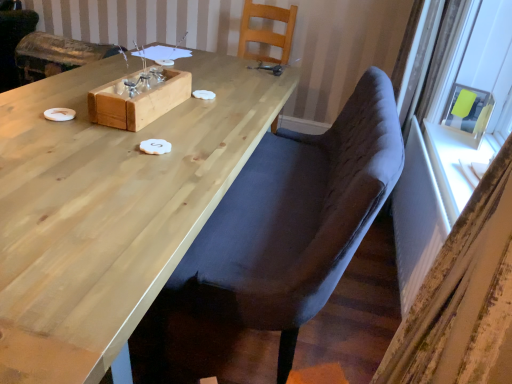
This screenshot has width=512, height=384. What do you see at coordinates (289, 226) in the screenshot?
I see `velvet grey chair at center, the 2th chair from the back` at bounding box center [289, 226].

What do you see at coordinates (110, 208) in the screenshot? This screenshot has height=384, width=512. I see `natural wood table at center` at bounding box center [110, 208].

Identify the location of wooden box at center. (138, 102).

What do you see at coordinates (138, 102) in the screenshot? I see `wooden box at center` at bounding box center [138, 102].

How much space does wooden chair at upper center, arranged as the 1th chair when viewed from the back, occupy vertically?

The height of wooden chair at upper center, arranged as the 1th chair when viewed from the back, is 36.53 inches.

You are a GUI agent. You are given a task and a screenshot of the screen. Output one action in this format:
    pyautogui.click(x=<x>, y=<y>)
    Task: Click on the wooden chair at upper center, placed as the 2th chair when sorted from front to back
    
    Given the screenshot: What is the action you would take?
    pyautogui.click(x=267, y=30)

You are a GUI agent. You are given a task and a screenshot of the screen. Output one action in this format:
    pyautogui.click(x=<x>, y=<y>)
    Task: Click on the yellow paper at upper right
    
    Given the screenshot: What is the action you would take?
    pyautogui.click(x=468, y=109)

Measure the distance between point (x=504, y=253) and camera.

Point (x=504, y=253) and camera are 28.98 inches apart.

Find the location of a particular element. velvet grey chair at center, the 2th chair from the back is located at coordinates (289, 226).

Between point (268, 8) and point (55, 52), which one is positioned behind?

Point (55, 52)

How different are the orientations of wooden chair at upper center, placed as the 2th chair when sorted from front to back, and wooden armchair at upper left in degrees?

4.15 degrees.

Considering the relative sizes of wooden chair at upper center, placed as the 2th chair when sorted from front to back, and wooden armchair at upper left in the image provided, is wooden chair at upper center, placed as the 2th chair when sorted from front to back, thinner than wooden armchair at upper left?

No.

Which object is thinner, velvet grey chair at center, arranged as the first chair when viewed from the front, or yellow paper at upper right?

With smaller width is yellow paper at upper right.

From the image's perspective, which is above, velvet grey chair at center, the 2th chair from the back, or yellow paper at upper right?

yellow paper at upper right appears higher in the image.

Considering the relative sizes of velvet grey chair at center, arranged as the first chair when viewed from the front, and yellow paper at upper right in the image provided, is velvet grey chair at center, arranged as the first chair when viewed from the front, taller than yellow paper at upper right?

Indeed, velvet grey chair at center, arranged as the first chair when viewed from the front, has a greater height compared to yellow paper at upper right.

Is wooden chair at upper center, placed as the 2th chair when sorted from front to back, further to the viewer compared to natural wood table at center?

Yes, it is.

From a real-world perspective, is wooden chair at upper center, arranged as the 1th chair when viewed from the back, beneath natural wood table at center?

Incorrect, from a real-world perspective, wooden chair at upper center, arranged as the 1th chair when viewed from the back, is higher than natural wood table at center.

Does wooden chair at upper center, placed as the 2th chair when sorted from front to back, appear on the left side of natural wood table at center?

No.

Which object is wider, wooden chair at upper center, arranged as the 1th chair when viewed from the back, or natural wood table at center?

natural wood table at center.

Does natural wood table at center contain wooden chair at upper center, arranged as the 1th chair when viewed from the back?

No, wooden chair at upper center, arranged as the 1th chair when viewed from the back, is not a part of natural wood table at center.

Does natural wood table at center lie in front of wooden chair at upper center, arranged as the 1th chair when viewed from the back?

Yes, natural wood table at center is closer to the viewer.

Based on the photo, from a real-world perspective, is natural wood table at center below wooden chair at upper center, arranged as the 1th chair when viewed from the back?

Yes, from a real-world perspective, natural wood table at center is beneath wooden chair at upper center, arranged as the 1th chair when viewed from the back.

The image size is (512, 384). In order to click on chair lying above the natural wood table at center (from the image's perspective) in this screenshot , I will do `click(267, 30)`.

Which is more to the left, wooden armchair at upper left or wooden box at center?

From the viewer's perspective, wooden armchair at upper left appears more on the left side.

Between wooden armchair at upper left and wooden box at center, which one is positioned in front?

wooden box at center is more forward.

Is wooden armchair at upper left positioned beyond the bounds of wooden box at center?

Yes, wooden armchair at upper left is not within wooden box at center.

Does wooden armchair at upper left have a lesser height compared to wooden box at center?

No.

Between natural wood table at center and yellow paper at upper right, which one has smaller width?

yellow paper at upper right.

Considering the sizes of objects natural wood table at center and yellow paper at upper right in the image provided, who is bigger, natural wood table at center or yellow paper at upper right?

natural wood table at center is bigger.

Is natural wood table at center taller than yellow paper at upper right?

Indeed, natural wood table at center has a greater height compared to yellow paper at upper right.

Identify the location of window screen above the natural wood table at center (from the image's perspective). (468, 109).

Considering the positions of objects wooden box at center and yellow paper at upper right in the image provided, who is more to the right, wooden box at center or yellow paper at upper right?

Positioned to the right is yellow paper at upper right.

Can you see wooden box at center touching yellow paper at upper right?

They are not placed beside each other.

Considering the relative sizes of wooden box at center and yellow paper at upper right in the image provided, is wooden box at center shorter than yellow paper at upper right?

Correct, wooden box at center is not as tall as yellow paper at upper right.

Is wooden box at center oriented away from yellow paper at upper right?

That's right, wooden box at center is facing away from yellow paper at upper right.

Locate an element on the screen. chair that is the 1st object located below the wooden armchair at upper left (from the image's perspective) is located at coordinates (267, 30).

Locate an element on the screen. The height and width of the screenshot is (384, 512). window screen that appears on the right of velvet grey chair at center, the 2th chair from the back is located at coordinates (468, 109).

When comparing their distances from wooden armchair at upper left, does wooden box at center or satin gray curtain at right seem closer?

Among the two, wooden box at center is located nearer to wooden armchair at upper left.

Which object lies further to the anchor point satin gray curtain at right, velvet grey chair at center, arranged as the first chair when viewed from the front, or wooden box at center?

wooden box at center is further to satin gray curtain at right.

Looking at the image, which one is located further to natural wood table at center, velvet grey chair at center, the 2th chair from the back, or wooden box at center?

velvet grey chair at center, the 2th chair from the back, lies further to natural wood table at center than the other object.

Looking at this image, considering their positions, is wooden box at center positioned further to wooden chair at upper center, arranged as the 1th chair when viewed from the back, than yellow paper at upper right?

The object further to wooden chair at upper center, arranged as the 1th chair when viewed from the back, is wooden box at center.

Consider the image. Which object lies further to the anchor point satin gray curtain at right, wooden chair at upper center, arranged as the 1th chair when viewed from the back, or velvet grey chair at center, the 2th chair from the back?

wooden chair at upper center, arranged as the 1th chair when viewed from the back.

Considering their positions, is wooden armchair at upper left positioned closer to wooden box at center than velvet grey chair at center, arranged as the first chair when viewed from the front?

velvet grey chair at center, arranged as the first chair when viewed from the front.

Estimate the real-world distances between objects in this image. Which object is further from velvet grey chair at center, arranged as the first chair when viewed from the front, wooden box at center or wooden chair at upper center, placed as the 2th chair when sorted from front to back?

wooden chair at upper center, placed as the 2th chair when sorted from front to back.

Looking at the image, which one is located closer to natural wood table at center, wooden armchair at upper left or satin gray curtain at right?

Among the two, satin gray curtain at right is located nearer to natural wood table at center.

Find the location of `box situated between wooden armchair at upper left and yellow paper at upper right from left to right`. box situated between wooden armchair at upper left and yellow paper at upper right from left to right is located at coordinates (138, 102).

At what (x,y) coordinates should I click in order to perform the action: click on box between satin gray curtain at right and wooden chair at upper center, placed as the 2th chair when sorted from front to back, from front to back. Please return your answer as a coordinate pair (x, y). Looking at the image, I should click on (138, 102).

Find the location of a particular element. This screenshot has width=512, height=384. table between wooden armchair at upper left and yellow paper at upper right is located at coordinates (110, 208).

Image resolution: width=512 pixels, height=384 pixels. I want to click on window screen between natural wood table at center and wooden chair at upper center, placed as the 2th chair when sorted from front to back, from front to back, so click(x=468, y=109).